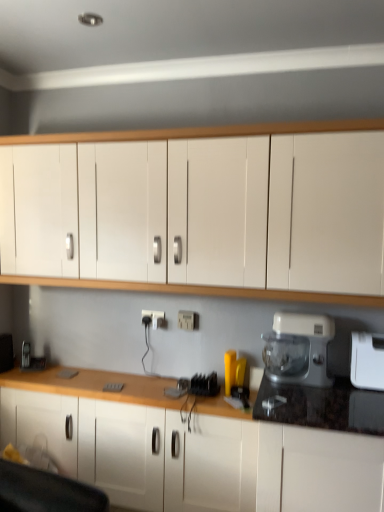
Question: Which direction should I rotate to look at white plastic electric outlet at center, arranged as the 2th electric outlet when viewed from the right?

Choices:
 (A) right
 (B) left

Answer: (B)

Question: Is white plastic food processor at right at the left side of white plastic electric outlet at center, arranged as the first electric outlet when viewed from the back?

Choices:
 (A) yes
 (B) no

Answer: (B)

Question: From the image's perspective, is white plastic food processor at right above white plastic electric outlet at center, arranged as the 2th electric outlet when viewed from the right?

Choices:
 (A) yes
 (B) no

Answer: (B)

Question: Is white plastic food processor at right thinner than white plastic electric outlet at center, arranged as the first electric outlet when viewed from the back?

Choices:
 (A) no
 (B) yes

Answer: (A)

Question: Is white plastic food processor at right not within white plastic electric outlet at center, arranged as the first electric outlet when viewed from the back?

Choices:
 (A) yes
 (B) no

Answer: (A)

Question: Can you confirm if white plastic food processor at right is smaller than white plastic electric outlet at center, arranged as the 2th electric outlet when viewed from the right?

Choices:
 (A) no
 (B) yes

Answer: (A)

Question: From the image's perspective, does white plastic food processor at right appear lower than white plastic electric outlet at center, the 1th electric outlet viewed from the left?

Choices:
 (A) yes
 (B) no

Answer: (A)

Question: Would you say white matte cabinet at upper center, marked as the 2th cabinetry in a bottom-to-top arrangement, is part of white plastic toaster at right's contents?

Choices:
 (A) no
 (B) yes

Answer: (A)

Question: Considering the relative sizes of white plastic toaster at right and white matte cabinet at upper center, which is the first cabinetry in top-to-bottom order, in the image provided, is white plastic toaster at right taller than white matte cabinet at upper center, which is the first cabinetry in top-to-bottom order,?

Choices:
 (A) no
 (B) yes

Answer: (A)

Question: Is white plastic toaster at right positioned in front of white matte cabinet at upper center, which is the first cabinetry in top-to-bottom order?

Choices:
 (A) no
 (B) yes

Answer: (A)

Question: From a real-world perspective, does white plastic toaster at right sit lower than white matte cabinet at upper center, marked as the 2th cabinetry in a bottom-to-top arrangement?

Choices:
 (A) no
 (B) yes

Answer: (B)

Question: Can you confirm if white plastic toaster at right is thinner than white matte cabinet at upper center, which is the first cabinetry in top-to-bottom order?

Choices:
 (A) yes
 (B) no

Answer: (A)

Question: Is white plastic toaster at right far from white matte cabinet at upper center, which is the first cabinetry in top-to-bottom order?

Choices:
 (A) yes
 (B) no

Answer: (B)

Question: Does white plastic electric outlet at center, arranged as the first electric outlet when viewed from the back, come behind white plastic toaster at right?

Choices:
 (A) no
 (B) yes

Answer: (B)